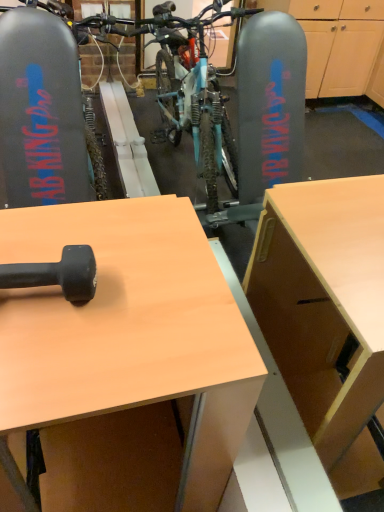
Question: Is light brown wood desk at center positioned far away from black rubber dumbbell at upper left?

Choices:
 (A) yes
 (B) no

Answer: (B)

Question: Is light brown wood desk at center further to camera compared to black rubber dumbbell at upper left?

Choices:
 (A) yes
 (B) no

Answer: (B)

Question: Is light brown wood desk at center not within black rubber dumbbell at upper left?

Choices:
 (A) yes
 (B) no

Answer: (A)

Question: Is black rubber dumbbell at upper left surrounded by light brown wood desk at center?

Choices:
 (A) no
 (B) yes

Answer: (A)

Question: Is light brown wood desk at center to the left of black rubber dumbbell at upper left from the viewer's perspective?

Choices:
 (A) no
 (B) yes

Answer: (A)

Question: Is light brown wood desk at center to the right of black rubber dumbbell at upper left from the viewer's perspective?

Choices:
 (A) yes
 (B) no

Answer: (A)

Question: Is the position of black rubber dumbbell at upper left more distant than that of light brown wood desk at center?

Choices:
 (A) no
 (B) yes

Answer: (B)

Question: Does black rubber dumbbell at upper left have a larger size compared to light brown wood desk at center?

Choices:
 (A) yes
 (B) no

Answer: (B)

Question: Considering the relative sizes of black rubber dumbbell at upper left and light brown wood desk at center in the image provided, is black rubber dumbbell at upper left taller than light brown wood desk at center?

Choices:
 (A) yes
 (B) no

Answer: (B)

Question: Is black rubber dumbbell at upper left far away from light brown wood desk at center?

Choices:
 (A) no
 (B) yes

Answer: (A)

Question: Can you confirm if black rubber dumbbell at upper left is shorter than light brown wood desk at center?

Choices:
 (A) no
 (B) yes

Answer: (B)

Question: Considering the relative sizes of black rubber dumbbell at upper left and light brown wood desk at center in the image provided, is black rubber dumbbell at upper left wider than light brown wood desk at center?

Choices:
 (A) yes
 (B) no

Answer: (B)

Question: From the image's perspective, relative to light brown wood desk at center, is black rubber dumbbell at upper left above or below?

Choices:
 (A) below
 (B) above

Answer: (B)